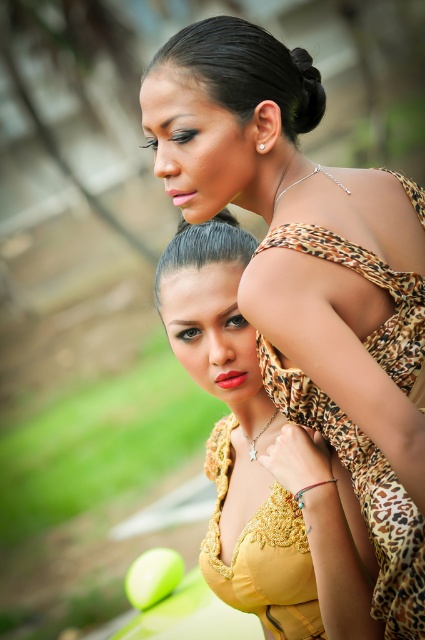
Can you confirm if yellow satin dress at center is positioned above black silky hair at upper center?

No.

Describe the element at coordinates (261, 554) in the screenshot. This screenshot has width=425, height=640. I see `yellow satin dress at center` at that location.

I want to click on yellow satin dress at center, so click(261, 554).

Is point (169, 49) positioned after point (306, 68)?

No, it is not.

Which of these two, sleek black hair at upper center or black silky hair at upper center, stands taller?

sleek black hair at upper center is taller.

What do you see at coordinates (248, 70) in the screenshot? This screenshot has height=640, width=425. I see `sleek black hair at upper center` at bounding box center [248, 70].

The image size is (425, 640). Find the location of `sleek black hair at upper center`. sleek black hair at upper center is located at coordinates (248, 70).

Between leopard print dress at upper center and sleek black hair at upper center, which one appears on the right side from the viewer's perspective?

Positioned to the right is leopard print dress at upper center.

Which is below, leopard print dress at upper center or sleek black hair at upper center?

leopard print dress at upper center is below.

Which is in front, point (294, 301) or point (285, 122)?

Point (294, 301) is in front.

At what (x,y) coordinates should I click in order to perform the action: click on leopard print dress at upper center. Please return your answer as a coordinate pair (x, y). Looking at the image, I should click on (311, 276).